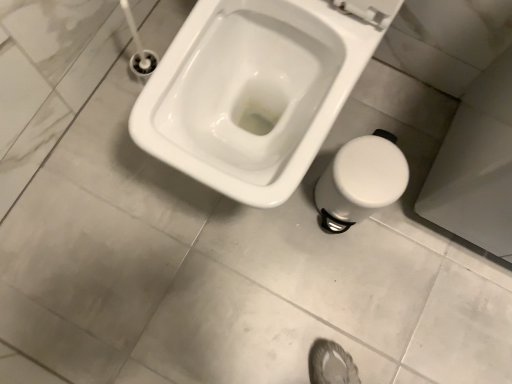
Measure the distance between point (x=243, y=89) and camera.

Point (x=243, y=89) and camera are 3.48 feet apart from each other.

Describe the element at coordinates (253, 92) in the screenshot. The width and height of the screenshot is (512, 384). I see `white glossy toilet at center` at that location.

The width and height of the screenshot is (512, 384). In order to click on white glossy toilet at center in this screenshot , I will do `click(253, 92)`.

Where is `white plastic bidet at lower right`? This screenshot has width=512, height=384. white plastic bidet at lower right is located at coordinates (361, 180).

The image size is (512, 384). Describe the element at coordinates (361, 180) in the screenshot. I see `white plastic bidet at lower right` at that location.

The image size is (512, 384). I want to click on white glossy toilet at center, so click(x=253, y=92).

Is white plastic bidet at lower right to the left or to the right of white glossy toilet at center in the image?

white plastic bidet at lower right is to the right of white glossy toilet at center.

Which object is further away from the camera, white plastic bidet at lower right or white glossy toilet at center?

white plastic bidet at lower right is behind.

Which is in front, point (366, 184) or point (273, 200)?

Point (273, 200)

From the image's perspective, is white plastic bidet at lower right below white glossy toilet at center?

Yes, from the image's perspective, white plastic bidet at lower right is beneath white glossy toilet at center.

From a real-world perspective, is white plastic bidet at lower right physically located above or below white glossy toilet at center?

white plastic bidet at lower right is below white glossy toilet at center.

In terms of width, does white plastic bidet at lower right look wider or thinner when compared to white glossy toilet at center?

In the image, white plastic bidet at lower right appears to be more narrow than white glossy toilet at center.

Can you confirm if white plastic bidet at lower right is shorter than white glossy toilet at center?

Correct, white plastic bidet at lower right is not as tall as white glossy toilet at center.

Who is bigger, white plastic bidet at lower right or white glossy toilet at center?

Bigger between the two is white glossy toilet at center.

Is white plastic bidet at lower right surrounding white glossy toilet at center?

No, white glossy toilet at center is not a part of white plastic bidet at lower right.

Is white plastic bidet at lower right directly adjacent to white glossy toilet at center?

No, white plastic bidet at lower right is not in contact with white glossy toilet at center.

Is white plastic bidet at lower right facing towards white glossy toilet at center?

No, white plastic bidet at lower right is not facing towards white glossy toilet at center.

Measure the distance from white plastic bidet at lower right to white glossy toilet at center.

A distance of 23.92 centimeters exists between white plastic bidet at lower right and white glossy toilet at center.

At what (x,y) coordinates should I click in order to perform the action: click on toilet to the left of white plastic bidet at lower right. Please return your answer as a coordinate pair (x, y). Looking at the image, I should click on (253, 92).

Can you confirm if white glossy toilet at center is positioned to the right of white plastic bidet at lower right?

No.

Considering the positions of objects white glossy toilet at center and white plastic bidet at lower right in the image provided, who is in front, white glossy toilet at center or white plastic bidet at lower right?

white glossy toilet at center.

Considering the positions of point (150, 87) and point (336, 187), is point (150, 87) closer or farther from the camera than point (336, 187)?

Clearly, point (150, 87) is closer to the camera than point (336, 187).

From the image's perspective, would you say white glossy toilet at center is shown under white plastic bidet at lower right?

No, from the image's perspective, white glossy toilet at center is not beneath white plastic bidet at lower right.

From a real-world perspective, is white glossy toilet at center positioned over white plastic bidet at lower right based on gravity?

Indeed, from a real-world perspective, white glossy toilet at center stands above white plastic bidet at lower right.

Does white glossy toilet at center have a lesser width compared to white plastic bidet at lower right?

In fact, white glossy toilet at center might be wider than white plastic bidet at lower right.

Considering the relative sizes of white glossy toilet at center and white plastic bidet at lower right in the image provided, is white glossy toilet at center taller than white plastic bidet at lower right?

Correct, white glossy toilet at center is much taller as white plastic bidet at lower right.

Can you confirm if white glossy toilet at center is smaller than white plastic bidet at lower right?

Actually, white glossy toilet at center might be larger than white plastic bidet at lower right.

Consider the image. Is white glossy toilet at center inside or outside of white plastic bidet at lower right?

white glossy toilet at center is not inside white plastic bidet at lower right, it's outside.

Would you consider white glossy toilet at center to be distant from white plastic bidet at lower right?

They are positioned close to each other.

Does white glossy toilet at center turn towards white plastic bidet at lower right?

No, white glossy toilet at center is not turned towards white plastic bidet at lower right.

Where is `toilet on the left side of white plastic bidet at lower right`? This screenshot has width=512, height=384. toilet on the left side of white plastic bidet at lower right is located at coordinates (253, 92).

I want to click on bidet that is under the white glossy toilet at center (from a real-world perspective), so click(361, 180).

The width and height of the screenshot is (512, 384). What are the coordinates of `bidet behind the white glossy toilet at center` in the screenshot? It's located at (361, 180).